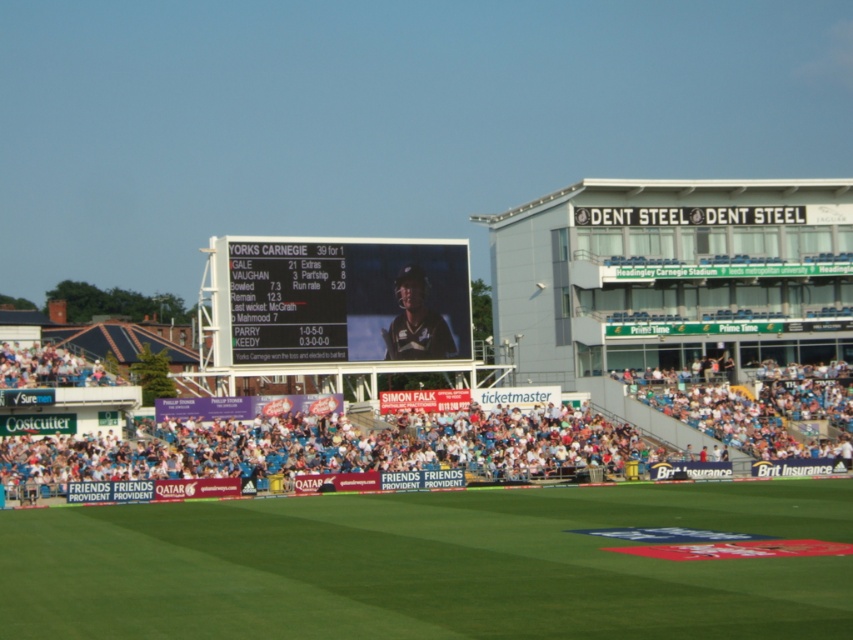
Question: Does green grass at center lie behind white fabric crowd at lower center?

Choices:
 (A) no
 (B) yes

Answer: (A)

Question: Which object appears closest to the camera in this image?

Choices:
 (A) green grass at center
 (B) white fabric crowd at lower center
 (C) black plastic scoreboard at center

Answer: (A)

Question: Where is green grass at center located in relation to black plastic scoreboard at center in the image?

Choices:
 (A) above
 (B) below

Answer: (B)

Question: Which object is the farthest from the white fabric crowd at lower center?

Choices:
 (A) green grass at center
 (B) black plastic scoreboard at center

Answer: (A)

Question: Does white fabric crowd at lower center appear under black plastic scoreboard at center?

Choices:
 (A) no
 (B) yes

Answer: (B)

Question: Which of the following is the closest to the observer?

Choices:
 (A) black plastic scoreboard at center
 (B) white fabric crowd at lower center
 (C) green grass at center

Answer: (C)